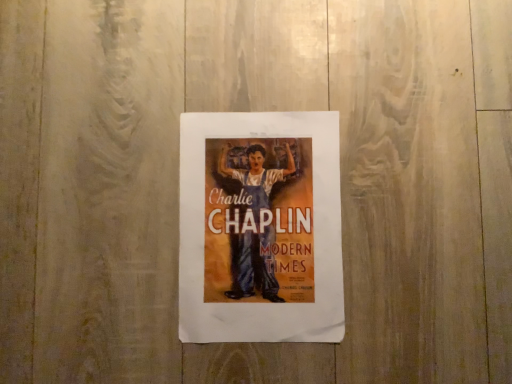
Image resolution: width=512 pixels, height=384 pixels. In order to click on free location above matte paper poster at center (from a real-world perspective) in this screenshot , I will do `click(264, 221)`.